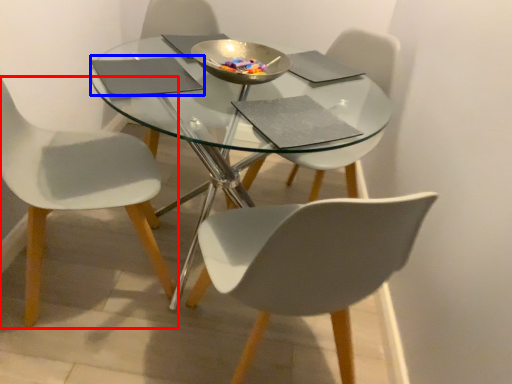
Question: Which of the following is the closest to the observer, chair (highlighted by a red box) or pad (highlighted by a blue box)?

Choices:
 (A) chair
 (B) pad

Answer: (A)